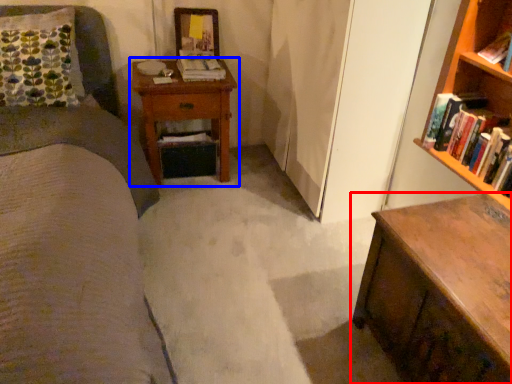
Question: Which point is closer to the camera, chest of drawers (highlighted by a red box) or nightstand (highlighted by a blue box)?

Choices:
 (A) chest of drawers
 (B) nightstand

Answer: (A)